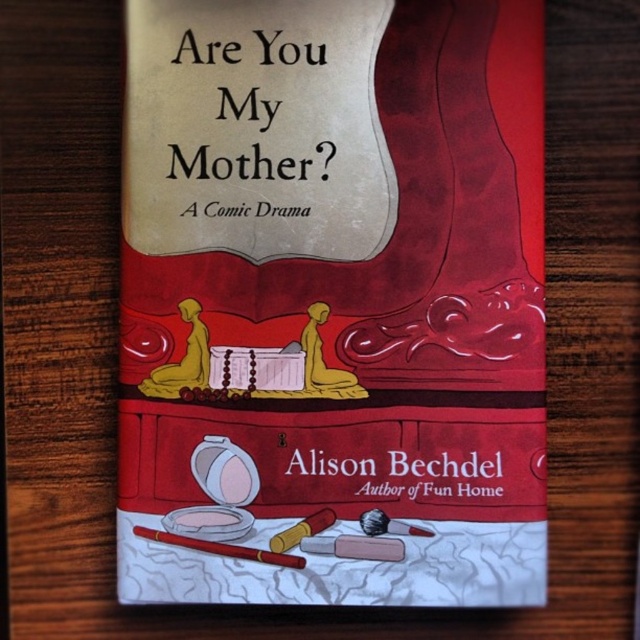
Does matte paper book at center appear over smooth brown pencil at bottom center?

Yes, matte paper book at center is above smooth brown pencil at bottom center.

Is matte paper book at center bigger than smooth brown pencil at bottom center?

Yes.

Find the location of `matte paper book at center`. matte paper book at center is located at coordinates (333, 301).